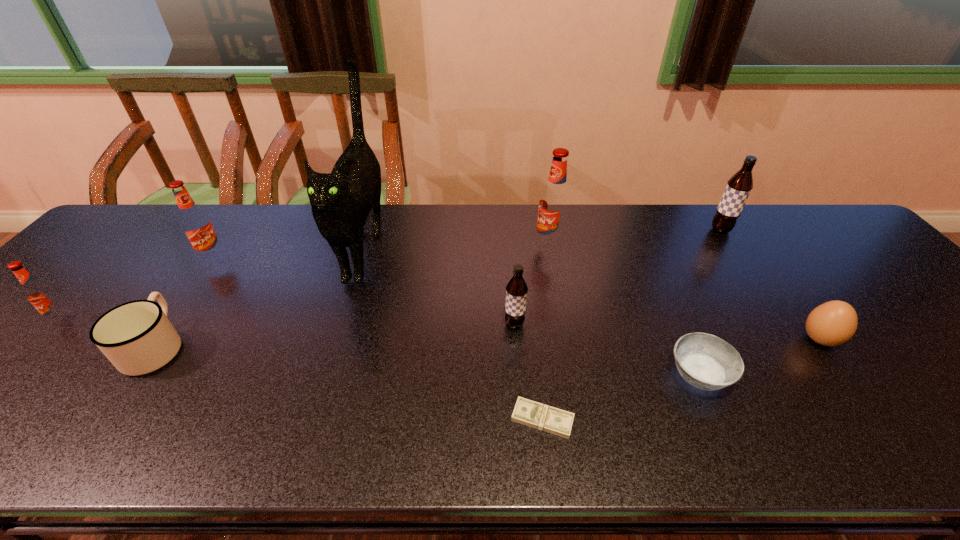
Select which root beer appears as the closest to the third root beer from left to right. Please provide its 2D coordinates. Your answer should be formatted as a tuple, i.e. [(x, y)], where the tuple contains the x and y coordinates of a point satisfying the conditions above.

[(554, 202)]

Identify the location of red root beer identified as the second closest to the ashtray. Image resolution: width=960 pixels, height=540 pixels. (195, 223).

Identify which red root beer is located as the second nearest to the ashtray. Please provide its 2D coordinates. Your answer should be formatted as a tuple, i.e. [(x, y)], where the tuple contains the x and y coordinates of a point satisfying the conditions above.

[(195, 223)]

Image resolution: width=960 pixels, height=540 pixels. Find the location of `free space that satisfies the following two spatial constraints: 1. on the face of the shortest object; 2. on the left side of the black cat`. free space that satisfies the following two spatial constraints: 1. on the face of the shortest object; 2. on the left side of the black cat is located at coordinates (311, 419).

I want to click on free location that satisfies the following two spatial constraints: 1. on the face of the second shortest object; 2. on the right side of the black cat, so click(x=325, y=375).

Where is `vacant area in the image that satisfies the following two spatial constraints: 1. on the front side of the rightmost red root beer; 2. on the right side of the third object from right to left`? vacant area in the image that satisfies the following two spatial constraints: 1. on the front side of the rightmost red root beer; 2. on the right side of the third object from right to left is located at coordinates tap(573, 375).

Where is `free point that satisfies the following two spatial constraints: 1. on the face of the black cat; 2. on the left side of the left brown root beer`? free point that satisfies the following two spatial constraints: 1. on the face of the black cat; 2. on the left side of the left brown root beer is located at coordinates (341, 324).

This screenshot has width=960, height=540. What are the coordinates of `free location that satisfies the following two spatial constraints: 1. on the face of the black cat; 2. on the right side of the shortest object` in the screenshot? It's located at (311, 419).